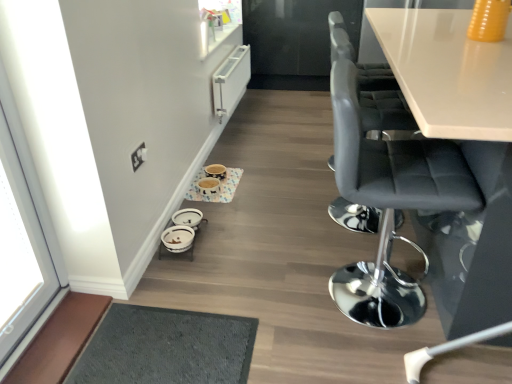
This screenshot has width=512, height=384. What do you see at coordinates (372, 88) in the screenshot? I see `gray fabric chair at right, the 2th chair viewed from the front` at bounding box center [372, 88].

Locate an element on the screen. Image resolution: width=512 pixels, height=384 pixels. matte ceramic bowls at center, the first round table positioned from the back is located at coordinates (219, 187).

Describe the element at coordinates (219, 187) in the screenshot. I see `matte ceramic bowls at center, the first round table positioned from the back` at that location.

Based on the photo, measure the distance between black leather stool at right, placed as the first chair when sorted from front to back, and camera.

A distance of 3.95 feet exists between black leather stool at right, placed as the first chair when sorted from front to back, and camera.

Locate an element on the screen. The width and height of the screenshot is (512, 384). white glass window at left is located at coordinates (28, 242).

This screenshot has width=512, height=384. What are the coordinates of `gray fabric chair at right, the 2th chair viewed from the front` in the screenshot? It's located at (372, 88).

Does black leather stool at right, the second chair positioned from the back, appear on the left side of matte ceramic bowls at center, which is the second round table from bottom to top?

No.

Is point (418, 184) closer to viewer compared to point (230, 189)?

Yes.

From a real-world perspective, relative to matte ceramic bowls at center, positioned as the 1th round table in top-to-bottom order, is black leather stool at right, placed as the first chair when sorted from front to back, vertically above or below?

Clearly, from a real-world perspective, black leather stool at right, placed as the first chair when sorted from front to back, is above matte ceramic bowls at center, positioned as the 1th round table in top-to-bottom order.

Can you confirm if black leather stool at right, placed as the first chair when sorted from front to back, is bigger than white ceramic bowls at lower center, acting as the first round table starting from the front?

Yes.

From a real-world perspective, between black leather stool at right, the second chair positioned from the back, and white ceramic bowls at lower center, which appears as the second round table when viewed from the top, who is vertically lower?

white ceramic bowls at lower center, which appears as the second round table when viewed from the top, is physically lower.

Is black leather stool at right, placed as the first chair when sorted from front to back, at the left side of white ceramic bowls at lower center, which appears as the second round table when viewed from the top?

Incorrect, black leather stool at right, placed as the first chair when sorted from front to back, is not on the left side of white ceramic bowls at lower center, which appears as the second round table when viewed from the top.

How many degrees apart are the facing directions of black leather stool at right, the second chair positioned from the back, and white ceramic bowls at lower center, acting as the first round table starting from the front?

They differ by 0.805 degrees in their facing directions.

Relative to white glass window at left, is white ceramic bowls at lower center, the first round table when ordered from bottom to top, in front or behind?

white ceramic bowls at lower center, the first round table when ordered from bottom to top, is behind white glass window at left.

Based on their sizes in the image, would you say white ceramic bowls at lower center, which appears as the second round table when viewed from the top, is bigger or smaller than white glass window at left?

Considering their sizes, white ceramic bowls at lower center, which appears as the second round table when viewed from the top, takes up less space than white glass window at left.

Considering the points (196, 216) and (47, 287), which point is in front, point (196, 216) or point (47, 287)?

The point (47, 287) is in front.

Is white ceramic bowls at lower center, which appears as the second round table when viewed from the top, taller or shorter than white glass window at left?

Considering their sizes, white ceramic bowls at lower center, which appears as the second round table when viewed from the top, has less height than white glass window at left.

Between black leather stool at right, the second chair positioned from the back, and gray fabric chair at right, the 1th chair when ordered from back to front, which one is positioned behind?

gray fabric chair at right, the 1th chair when ordered from back to front, is further away from the camera.

From the image's perspective, does black leather stool at right, placed as the first chair when sorted from front to back, appear lower than gray fabric chair at right, the 2th chair viewed from the front?

Yes, from the image's perspective, black leather stool at right, placed as the first chair when sorted from front to back, is below gray fabric chair at right, the 2th chair viewed from the front.

Which is more to the right, black leather stool at right, the second chair positioned from the back, or gray fabric chair at right, the 2th chair viewed from the front?

Positioned to the right is gray fabric chair at right, the 2th chair viewed from the front.

Do you think black leather stool at right, placed as the first chair when sorted from front to back, is within gray fabric chair at right, the 2th chair viewed from the front, or outside of it?

black leather stool at right, placed as the first chair when sorted from front to back, is outside gray fabric chair at right, the 2th chair viewed from the front.

From a real-world perspective, is white ceramic bowls at lower center, acting as the first round table starting from the front, physically below black leather stool at right, placed as the first chair when sorted from front to back?

Yes.

Can you confirm if white ceramic bowls at lower center, acting as the first round table starting from the front, is thinner than black leather stool at right, the second chair positioned from the back?

Indeed, white ceramic bowls at lower center, acting as the first round table starting from the front, has a lesser width compared to black leather stool at right, the second chair positioned from the back.

Would you say white ceramic bowls at lower center, acting as the first round table starting from the front, is a long distance from black leather stool at right, placed as the first chair when sorted from front to back?

white ceramic bowls at lower center, acting as the first round table starting from the front, is actually quite close to black leather stool at right, placed as the first chair when sorted from front to back.

Measure the distance between white ceramic bowls at lower center, which appears as the second round table when viewed from the top, and matte ceramic bowls at center, the first round table positioned from the back.

A distance of 33.96 centimeters exists between white ceramic bowls at lower center, which appears as the second round table when viewed from the top, and matte ceramic bowls at center, the first round table positioned from the back.

Is point (185, 231) in front of point (202, 199)?

Yes, it is.

Is white ceramic bowls at lower center, which appears as the second round table when viewed from the top, further to the viewer compared to matte ceramic bowls at center, which is the second round table from bottom to top?

No, the depth of white ceramic bowls at lower center, which appears as the second round table when viewed from the top, is less than that of matte ceramic bowls at center, which is the second round table from bottom to top.

Can we say white ceramic bowls at lower center, the first round table when ordered from bottom to top, lies outside matte ceramic bowls at center, the second round table in the front-to-back sequence?

Yes, white ceramic bowls at lower center, the first round table when ordered from bottom to top, is located beyond the bounds of matte ceramic bowls at center, the second round table in the front-to-back sequence.

From the image's perspective, would you say gray fabric chair at right, the 1th chair when ordered from back to front, is shown under white ceramic bowls at lower center, acting as the first round table starting from the front?

Incorrect, from the image's perspective, gray fabric chair at right, the 1th chair when ordered from back to front, is higher than white ceramic bowls at lower center, acting as the first round table starting from the front.

Does point (390, 116) come in front of point (185, 235)?

Yes, it is.

From a real-world perspective, relative to white ceramic bowls at lower center, the first round table when ordered from bottom to top, is gray fabric chair at right, the 1th chair when ordered from back to front, vertically above or below?

gray fabric chair at right, the 1th chair when ordered from back to front, is above white ceramic bowls at lower center, the first round table when ordered from bottom to top.

Locate an element on the screen. Image resolution: width=512 pixels, height=384 pixels. the 2nd chair in front of the matte ceramic bowls at center, the first round table positioned from the back, counting from the anchor's position is located at coordinates (389, 204).

You are a GUI agent. You are given a task and a screenshot of the screen. Output one action in this format:
    pyautogui.click(x=<x>, y=<y>)
    Task: Click on the round table below the black leather stool at right, placed as the first chair when sorted from front to back (from the image's perspective)
    Image resolution: width=512 pixels, height=384 pixels.
    Given the screenshot: What is the action you would take?
    pyautogui.click(x=181, y=233)

Considering their positions, is matte ceramic bowls at center, which is the second round table from bottom to top, positioned further to black leather stool at right, placed as the first chair when sorted from front to back, than gray fabric chair at right, the 1th chair when ordered from back to front?

matte ceramic bowls at center, which is the second round table from bottom to top, lies further to black leather stool at right, placed as the first chair when sorted from front to back, than the other object.

When comparing their distances from black leather stool at right, placed as the first chair when sorted from front to back, does gray fabric chair at right, the 2th chair viewed from the front, or white glass window at left seem further?

Among the two, white glass window at left is located further to black leather stool at right, placed as the first chair when sorted from front to back.

Considering their positions, is matte ceramic bowls at center, the second round table in the front-to-back sequence, positioned further to gray fabric chair at right, the 2th chair viewed from the front, than black leather stool at right, the second chair positioned from the back?

The object further to gray fabric chair at right, the 2th chair viewed from the front, is matte ceramic bowls at center, the second round table in the front-to-back sequence.

Estimate the real-world distances between objects in this image. Which object is closer to white glass window at left, gray fabric chair at right, the 1th chair when ordered from back to front, or matte ceramic bowls at center, positioned as the 1th round table in top-to-bottom order?

Among the two, matte ceramic bowls at center, positioned as the 1th round table in top-to-bottom order, is located nearer to white glass window at left.

When comparing their distances from matte ceramic bowls at center, positioned as the 1th round table in top-to-bottom order, does black leather stool at right, placed as the first chair when sorted from front to back, or gray fabric chair at right, the 2th chair viewed from the front, seem further?

black leather stool at right, placed as the first chair when sorted from front to back, lies further to matte ceramic bowls at center, positioned as the 1th round table in top-to-bottom order, than the other object.

Considering their positions, is white glass window at left positioned closer to white ceramic bowls at lower center, which is the 2th round table in back-to-front order, than matte ceramic bowls at center, the first round table positioned from the back?

The object closer to white ceramic bowls at lower center, which is the 2th round table in back-to-front order, is matte ceramic bowls at center, the first round table positioned from the back.

From the image, which object appears to be farther from matte ceramic bowls at center, which is the second round table from bottom to top, white ceramic bowls at lower center, the first round table when ordered from bottom to top, or black leather stool at right, placed as the first chair when sorted from front to back?

black leather stool at right, placed as the first chair when sorted from front to back, is further to matte ceramic bowls at center, which is the second round table from bottom to top.

Considering their positions, is gray fabric chair at right, the 1th chair when ordered from back to front, positioned closer to matte ceramic bowls at center, which is the second round table from bottom to top, than white glass window at left?

gray fabric chair at right, the 1th chair when ordered from back to front, is closer to matte ceramic bowls at center, which is the second round table from bottom to top.

Image resolution: width=512 pixels, height=384 pixels. I want to click on chair between black leather stool at right, the second chair positioned from the back, and matte ceramic bowls at center, the second round table in the front-to-back sequence, in the front-back direction, so click(x=372, y=88).

Locate an element on the screen. This screenshot has height=384, width=512. chair between white glass window at left and gray fabric chair at right, the 1th chair when ordered from back to front, in the horizontal direction is located at coordinates (389, 204).

The height and width of the screenshot is (384, 512). I want to click on round table between white ceramic bowls at lower center, the first round table when ordered from bottom to top, and gray fabric chair at right, the 1th chair when ordered from back to front, from left to right, so click(219, 187).

Locate an element on the screen. chair between white ceramic bowls at lower center, which appears as the second round table when viewed from the top, and gray fabric chair at right, the 1th chair when ordered from back to front, from left to right is located at coordinates (389, 204).